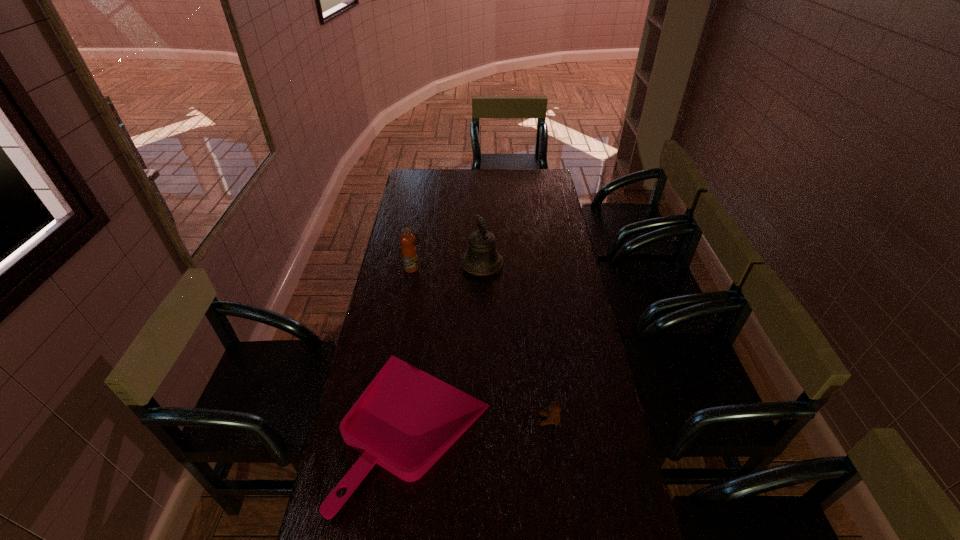
Identify the location of vacant area that lies between the shortest object and the bell. The width and height of the screenshot is (960, 540). click(449, 346).

This screenshot has width=960, height=540. I want to click on free space between the shortest object and the teddy bear, so click(483, 423).

Where is `vacant point located between the bell and the shortest object`? The height and width of the screenshot is (540, 960). vacant point located between the bell and the shortest object is located at coordinates (449, 346).

Find the location of a particular element. The image size is (960, 540). free space between the bell and the dustpan is located at coordinates (449, 346).

You are a GUI agent. You are given a task and a screenshot of the screen. Output one action in this format:
    pyautogui.click(x=<x>, y=<y>)
    Task: Click on the empty space between the fruit juice and the shortest object
    The width and height of the screenshot is (960, 540).
    Given the screenshot: What is the action you would take?
    click(415, 348)

What are the coordinates of `vacant area that lies between the rightmost object and the bell` in the screenshot? It's located at (516, 342).

Select which object appears as the third closest to the fruit juice. Please provide its 2D coordinates. Your answer should be formatted as a tuple, i.e. [(x, y)], where the tuple contains the x and y coordinates of a point satisfying the conditions above.

[(553, 416)]

Point out which object is positioned as the third nearest to the bell. Please provide its 2D coordinates. Your answer should be formatted as a tuple, i.e. [(x, y)], where the tuple contains the x and y coordinates of a point satisfying the conditions above.

[(553, 416)]